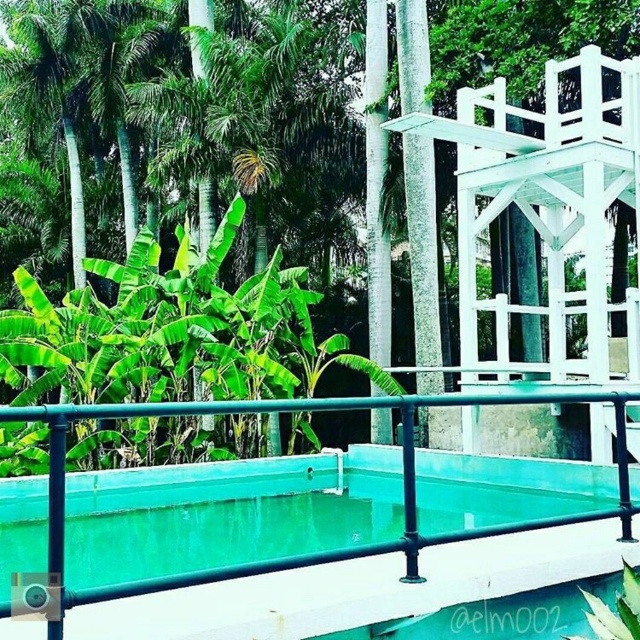
You are standing at the edge of the teal glossy pool at center and want to walk directly towards the green leafy tree at center. In which direction should you walk?

You should walk to the right because the teal glossy pool at center is to the left of the green leafy tree at center, so moving right will take you towards the tree.

You are planning to host a garden party and want to set up a shaded area near the teal glossy pool at center. The white painted wood gazebo at upper right is available. Based on the scene, can you determine if the gazebo is positioned in a way that it can provide shade over the pool during midday?

The teal glossy pool at center is positioned under white painted wood gazebo at upper right, so yes, the gazebo can provide shade over the pool during midday.